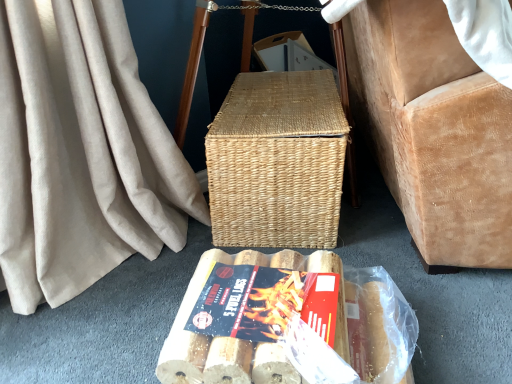
Question: Is wooden textured logs at center wider or thinner than wooden logs at lower center?

Choices:
 (A) wide
 (B) thin

Answer: (B)

Question: From the image's perspective, is wooden textured logs at center located above or below wooden logs at lower center?

Choices:
 (A) above
 (B) below

Answer: (A)

Question: Considering the real-world distances, which object is closest to the woven natural picnic basket at center?

Choices:
 (A) wooden textured logs at center
 (B) wooden logs at lower center
 (C) suede armchair at right

Answer: (C)

Question: Considering the real-world distances, which object is farthest from the suede armchair at right?

Choices:
 (A) wooden textured logs at center
 (B) wooden logs at lower center
 (C) woven natural picnic basket at center

Answer: (A)